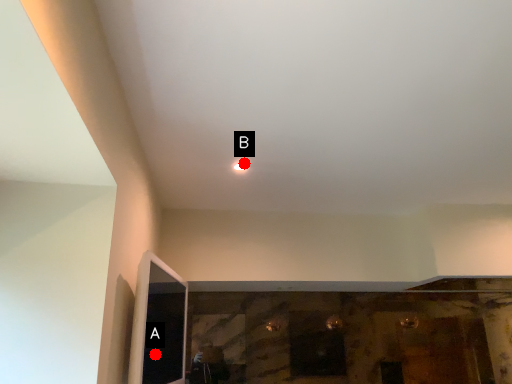
Question: Two points are circled on the image, labeled by A and B beside each circle. Which of the following is the farthest from the observer?

Choices:
 (A) A is further
 (B) B is further

Answer: (B)